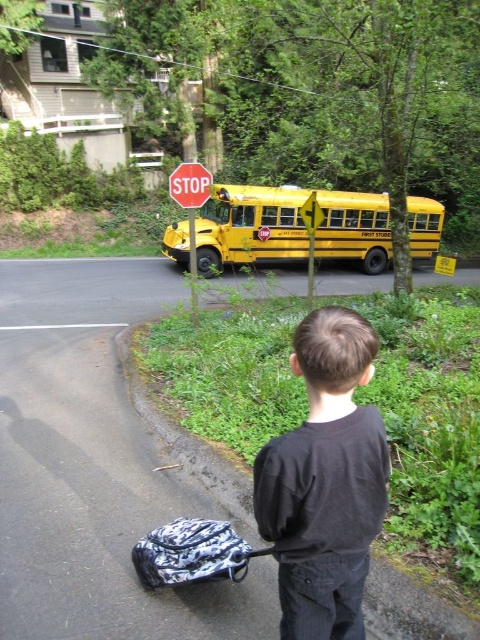
You are a pedestrian standing at the location of the black cotton shirt at center. You want to cross the road to the grassy area on the other side. The road is two lanes wide. The metallic yellow bus at center is blocking your view. Can you safely cross without being hit by a car coming from behind the bus?

The distance between the black cotton shirt at center and the metallic yellow bus at center is 31.94 feet. Since the bus is blocking your view, you cannot see if there are cars approaching from behind it. Therefore, it is not safe to cross the road in this situation.

You are a pedestrian trying to cross the road safely. You see the patterned fabric backpack at lower left and the metallic yellow bus at center. Which object is closer to the road?

The patterned fabric backpack at lower left is positioned under the metallic yellow bus at center, meaning it is closer to the road than the bus.